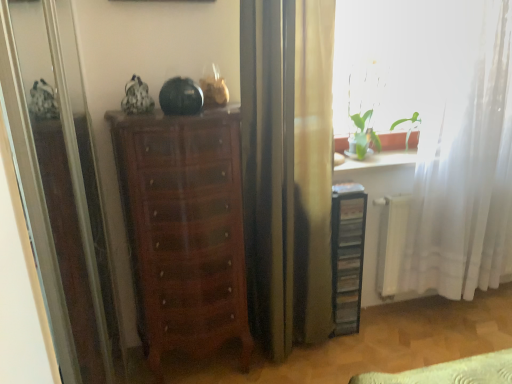
The width and height of the screenshot is (512, 384). What are the coordinates of `transparent glass screen door at left` in the screenshot? It's located at (59, 183).

What is the approximate width of black plastic file cabinet at right?

black plastic file cabinet at right is 6.92 inches in width.

What do you see at coordinates (460, 162) in the screenshot? I see `white sheer curtain at right` at bounding box center [460, 162].

The image size is (512, 384). What do you see at coordinates (184, 229) in the screenshot? I see `shiny brown chest of drawers at center` at bounding box center [184, 229].

Locate an element on the screen. This screenshot has width=512, height=384. transparent glass screen door at left is located at coordinates (59, 183).

From a real-world perspective, which object rests below the other?

In real-world perspective, black plastic file cabinet at right is lower.

You are a GUI agent. You are given a task and a screenshot of the screen. Output one action in this format:
    pyautogui.click(x=<x>, y=<y>)
    Task: Click on the file cabinet behind the white sheer curtain at right
    The width and height of the screenshot is (512, 384).
    Given the screenshot: What is the action you would take?
    pyautogui.click(x=347, y=255)

Which object is closer to the camera, white sheer curtain at right or black plastic file cabinet at right?

white sheer curtain at right is more forward.

Is point (409, 242) closer to viewer compared to point (357, 266)?

No, it is behind (357, 266).

Is white sheer curtain at right positioned with its back to transparent glass screen door at left?

No, white sheer curtain at right's orientation is not away from transparent glass screen door at left.

From the picture: Considering the relative sizes of white sheer curtain at right and transparent glass screen door at left in the image provided, is white sheer curtain at right wider than transparent glass screen door at left?

Yes, white sheer curtain at right is wider than transparent glass screen door at left.

Which object is positioned more to the right, white sheer curtain at right or transparent glass screen door at left?

white sheer curtain at right is more to the right.

From a real-world perspective, between transparent glass screen door at left and black plastic file cabinet at right, who is vertically lower?

black plastic file cabinet at right is physically lower.

Based on the photo, based on their sizes in the image, would you say transparent glass screen door at left is bigger or smaller than black plastic file cabinet at right?

transparent glass screen door at left is bigger than black plastic file cabinet at right.

Is transparent glass screen door at left not close to black plastic file cabinet at right?

That's right, there is a large distance between transparent glass screen door at left and black plastic file cabinet at right.

How much distance is there between transparent glass screen door at left and black plastic file cabinet at right?

transparent glass screen door at left is 1.26 meters from black plastic file cabinet at right.

Which point is more forward, (348,271) or (170,327)?

Positioned in front is point (170,327).

In the image, there is a black plastic file cabinet at right. At what (x,y) coordinates should I click in order to perform the action: click on the chest of drawers above it (from the image's perspective). Please return your answer as a coordinate pair (x, y). Looking at the image, I should click on (184, 229).

Which object is thinner, black plastic file cabinet at right or shiny brown chest of drawers at center?

black plastic file cabinet at right.

What's the angular difference between black plastic file cabinet at right and shiny brown chest of drawers at center's facing directions?

The angular difference between black plastic file cabinet at right and shiny brown chest of drawers at center is 0.646 degrees.

Looking at this image, could you tell me if black plastic file cabinet at right is turned towards white sheer curtain at right?

No, black plastic file cabinet at right is not facing towards white sheer curtain at right.

Can you confirm if black plastic file cabinet at right is thinner than white sheer curtain at right?

Correct, the width of black plastic file cabinet at right is less than that of white sheer curtain at right.

Is black plastic file cabinet at right positioned beyond the bounds of white sheer curtain at right?

That's correct, black plastic file cabinet at right is outside of white sheer curtain at right.

Is black plastic file cabinet at right at the right side of white sheer curtain at right?

Incorrect, black plastic file cabinet at right is not on the right side of white sheer curtain at right.

From the picture: Is shiny brown chest of drawers at center facing away from white sheer curtain at right?

That's not correct — shiny brown chest of drawers at center is not looking away from white sheer curtain at right.

From the image's perspective, is shiny brown chest of drawers at center over white sheer curtain at right?

No, from the image's perspective, shiny brown chest of drawers at center is not above white sheer curtain at right.

Does point (207, 227) come farther from viewer compared to point (435, 109)?

No, it is not.

Visually, is shiny brown chest of drawers at center positioned to the left or to the right of white sheer curtain at right?

shiny brown chest of drawers at center is to the left of white sheer curtain at right.

From a real-world perspective, does white sheer curtain at right sit lower than shiny brown chest of drawers at center?

No, from a real-world perspective, white sheer curtain at right is not below shiny brown chest of drawers at center.

Considering the relative positions of white sheer curtain at right and shiny brown chest of drawers at center in the image provided, is white sheer curtain at right to the left or to the right of shiny brown chest of drawers at center?

white sheer curtain at right is to the right of shiny brown chest of drawers at center.

Is point (444, 61) in front of point (190, 346)?

No, (444, 61) is further to viewer.

The width and height of the screenshot is (512, 384). Find the location of `curtain that is above the black plastic file cabinet at right (from the image's perspective)`. curtain that is above the black plastic file cabinet at right (from the image's perspective) is located at coordinates (460, 162).

Identify the location of screen door on the left of white sheer curtain at right. (59, 183).

Which object lies nearer to the anchor point shiny brown chest of drawers at center, black plastic file cabinet at right or transparent glass screen door at left?

transparent glass screen door at left is positioned closer to the anchor shiny brown chest of drawers at center.

Which object lies further to the anchor point shiny brown chest of drawers at center, transparent glass screen door at left or white sheer curtain at right?

white sheer curtain at right is positioned further to the anchor shiny brown chest of drawers at center.

From the image, which object appears to be farther from shiny brown chest of drawers at center, black plastic file cabinet at right or white sheer curtain at right?

The object further to shiny brown chest of drawers at center is white sheer curtain at right.

Based on their spatial positions, is white sheer curtain at right or shiny brown chest of drawers at center closer to black plastic file cabinet at right?

white sheer curtain at right lies closer to black plastic file cabinet at right than the other object.

When comparing their distances from transparent glass screen door at left, does black plastic file cabinet at right or shiny brown chest of drawers at center seem closer?

shiny brown chest of drawers at center is closer to transparent glass screen door at left.

Which object lies further to the anchor point white sheer curtain at right, shiny brown chest of drawers at center or black plastic file cabinet at right?

shiny brown chest of drawers at center.

From the picture: When comparing their distances from shiny brown chest of drawers at center, does white sheer curtain at right or transparent glass screen door at left seem further?

white sheer curtain at right is further to shiny brown chest of drawers at center.

Considering their positions, is shiny brown chest of drawers at center positioned closer to transparent glass screen door at left than black plastic file cabinet at right?

shiny brown chest of drawers at center is positioned closer to the anchor transparent glass screen door at left.

This screenshot has height=384, width=512. I want to click on the chest of drawers situated between transparent glass screen door at left and white sheer curtain at right from left to right, so click(184, 229).

Locate an element on the screen. the chest of drawers positioned between transparent glass screen door at left and black plastic file cabinet at right from near to far is located at coordinates (184, 229).

This screenshot has height=384, width=512. I want to click on file cabinet between shiny brown chest of drawers at center and white sheer curtain at right, so click(x=347, y=255).

In order to click on file cabinet located between transparent glass screen door at left and white sheer curtain at right in the left-right direction in this screenshot , I will do `click(347, 255)`.